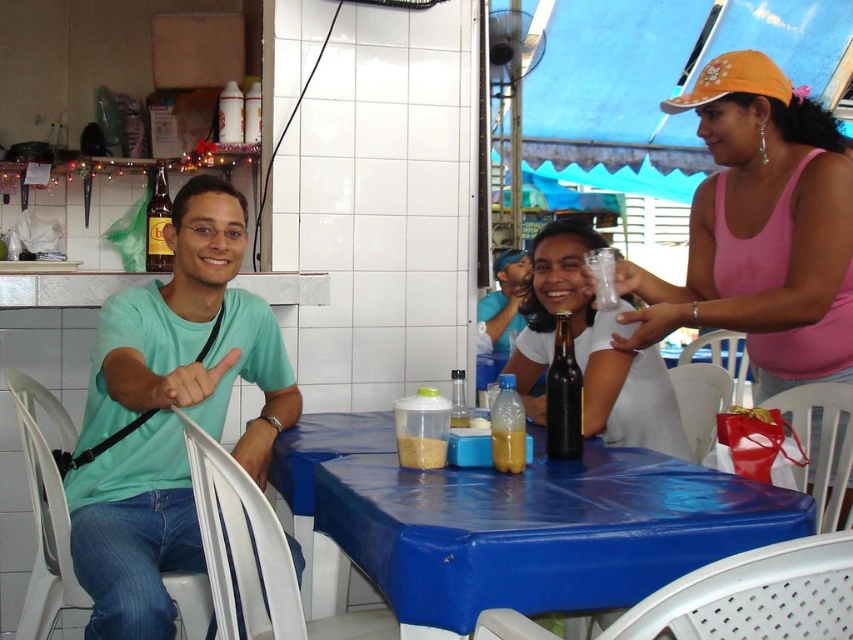
Question: Does brown glass bottle at table center come in front of translucent plastic cup at table center?

Choices:
 (A) yes
 (B) no

Answer: (B)

Question: Can you confirm if brown glass bottle at table center is positioned to the left of translucent plastic container at table center?

Choices:
 (A) yes
 (B) no

Answer: (B)

Question: Does brown glass bottle at upper left lie in front of translucent plastic cup at table center?

Choices:
 (A) yes
 (B) no

Answer: (B)

Question: Which of the following is the closest to the observer?

Choices:
 (A) (399, 435)
 (B) (561, 358)
 (C) (500, 380)
 (D) (494, 317)

Answer: (A)

Question: Which point is closer to the camera?

Choices:
 (A) [554, 381]
 (B) [490, 424]
 (C) [155, 218]
 (D) [788, 208]

Answer: (B)

Question: Which object is the farthest from the matte blue shirt at center?

Choices:
 (A) brown glass bottle at table center
 (B) blue plastic table at center
 (C) translucent plastic cup at table center
 (D) translucent plastic bottle at table center

Answer: (D)